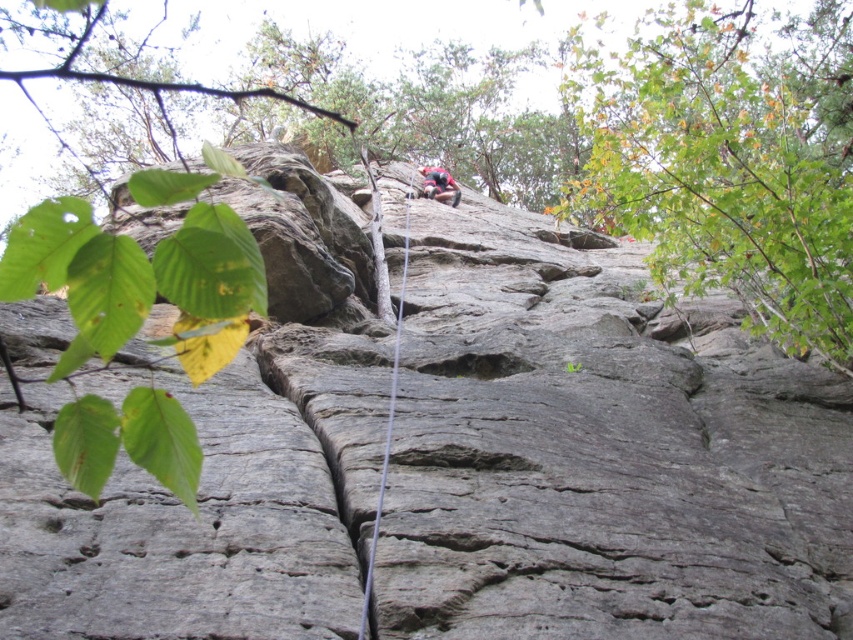
Who is taller, green leafy tree at upper right or reddish-brown climbing gear at center?

green leafy tree at upper right

Does green leafy tree at upper right have a lesser height compared to reddish-brown climbing gear at center?

No.

Is point (801, 273) positioned after point (426, 196)?

No.

Find the location of `green leafy tree at upper right`. green leafy tree at upper right is located at coordinates (729, 161).

Is gray/rough rope at center thinner than reddish-brown climbing gear at center?

Yes, gray/rough rope at center is thinner than reddish-brown climbing gear at center.

Who is higher up, gray/rough rope at center or reddish-brown climbing gear at center?

reddish-brown climbing gear at center

Between point (392, 410) and point (440, 168), which one is positioned in front?

Positioned in front is point (392, 410).

Find the location of a particular element. Image resolution: width=853 pixels, height=640 pixels. gray/rough rope at center is located at coordinates (386, 433).

Does green leafy tree at upper right have a lesser height compared to green leafy branch at upper left?

No.

How far apart are green leafy tree at upper right and green leafy branch at upper left?

green leafy tree at upper right and green leafy branch at upper left are 28.22 meters apart.

Who is more distant from viewer, (717, 19) or (3, 352)?

The point (717, 19) is more distant.

In order to click on green leafy tree at upper right in this screenshot , I will do `click(729, 161)`.